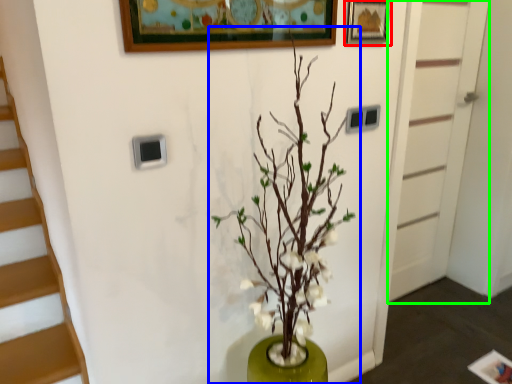
Question: Which is farther away from picture frame (highlighted by a red box)? houseplant (highlighted by a blue box) or door (highlighted by a green box)?

Choices:
 (A) houseplant
 (B) door

Answer: (B)